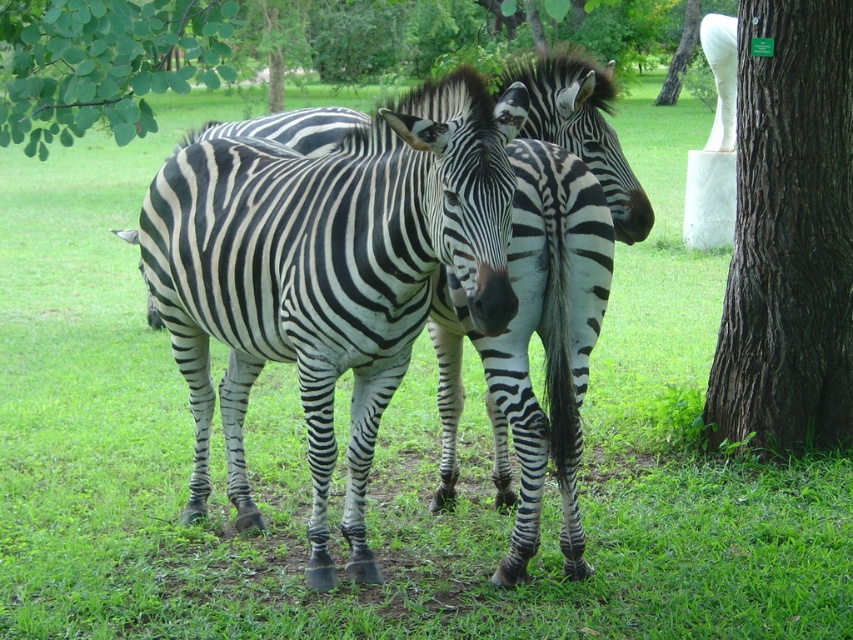
Question: Which of these objects is positioned closest to the dark brown textured bark at right?

Choices:
 (A) white marble statue at upper right
 (B) green leafy branch at upper left
 (C) black and white striped zebra at center

Answer: (C)

Question: Which point is closer to the camera taking this photo?

Choices:
 (A) (32, 65)
 (B) (824, 320)

Answer: (A)

Question: Is black and white striped zebra at center below green leafy branch at upper left?

Choices:
 (A) no
 (B) yes

Answer: (B)

Question: Is black and white striped zebra at center positioned before white marble statue at upper right?

Choices:
 (A) no
 (B) yes

Answer: (B)

Question: Is black and white striped zebra at center wider than green leafy branch at upper left?

Choices:
 (A) no
 (B) yes

Answer: (B)

Question: Which is nearer to the green leafy branch at upper left?

Choices:
 (A) black and white striped zebra at center
 (B) dark brown textured bark at right

Answer: (A)